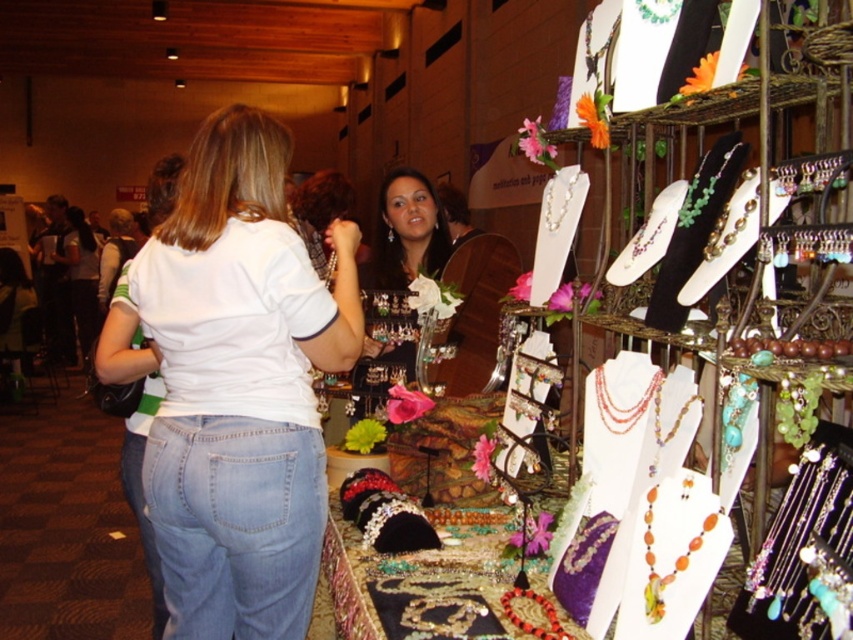
Question: Which object appears closest to the camera in this image?

Choices:
 (A) white matte shirt at upper left
 (B) multicolored beaded necklace at center
 (C) multicolored beaded necklace at right
 (D) matte black necklace at center

Answer: (C)

Question: Is the position of blue denim jeans at lower left more distant than that of matte black necklace at center?

Choices:
 (A) no
 (B) yes

Answer: (A)

Question: Is white matte shirt at upper left thinner than white matte shirt at center?

Choices:
 (A) no
 (B) yes

Answer: (A)

Question: Which object appears closest to the camera in this image?

Choices:
 (A) multicolored beaded necklace at right
 (B) multicolored beaded necklace at upper right
 (C) white matte shirt at upper left

Answer: (A)

Question: Which of the following is the closest to the observer?

Choices:
 (A) white cotton shirt at center
 (B) multicolored beaded necklace at center
 (C) orange coral necklace at center

Answer: (C)

Question: Can you confirm if white matte shirt at upper left is positioned to the left of blue denim jeans at lower left?

Choices:
 (A) no
 (B) yes

Answer: (B)